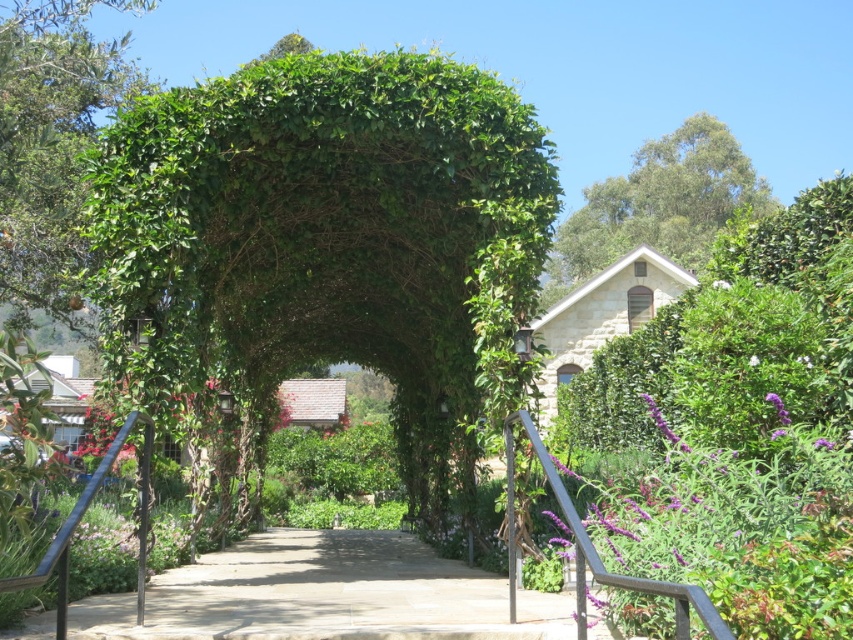
You are a gardener planning to install a new sprinkler system. You need to know the length of the gray concrete path at center and the height of the green leafy tree at upper left to ensure proper water coverage. Which one is shorter?

The gray concrete path at center is shorter than the green leafy tree at upper left, so the path requires less water coverage length while the tree needs taller sprinklers to reach its height.